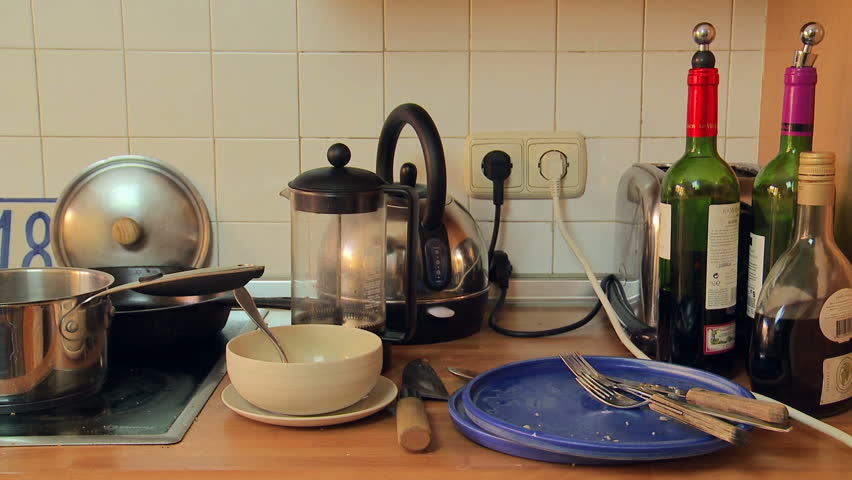
Locate an element on the screen. This screenshot has height=480, width=852. toaster is located at coordinates (636, 202).